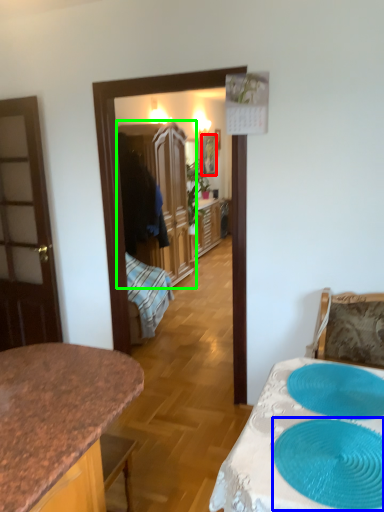
Question: Considering the real-world distances, which object is closest to picture frame (highlighted by a red box)? oval (highlighted by a blue box) or cabinetry (highlighted by a green box).

Choices:
 (A) oval
 (B) cabinetry

Answer: (B)